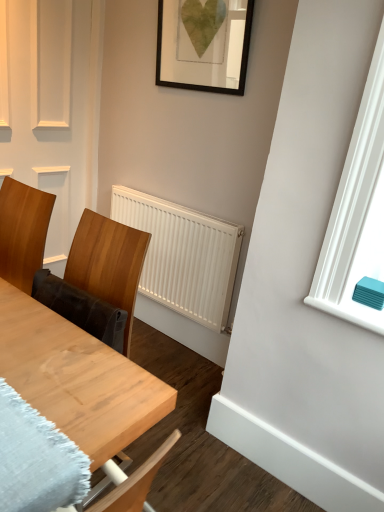
Question: In the image, is white matte radiator at center positioned in front of or behind wooden chair at left?

Choices:
 (A) behind
 (B) front

Answer: (A)

Question: From the image's perspective, is white matte radiator at center above or below wooden chair at left?

Choices:
 (A) below
 (B) above

Answer: (A)

Question: Which is farther from the wooden chair at left?

Choices:
 (A) white matte radiator at center
 (B) black matte picture frame at upper center
 (C) wooden table at center

Answer: (B)

Question: Estimate the real-world distances between objects in this image. Which object is farther from the black matte picture frame at upper center?

Choices:
 (A) wooden table at center
 (B) wooden chair at left
 (C) white matte radiator at center

Answer: (A)